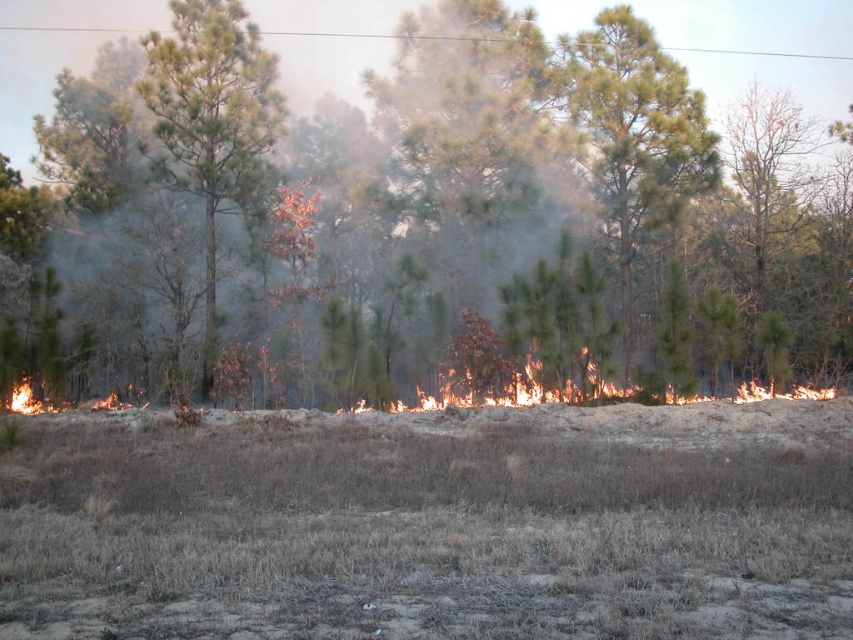
How far apart are green leafy tree at center and green matte tree at center?

5.05 meters

Is green leafy tree at center further to the viewer compared to green matte tree at center?

Yes, green leafy tree at center is further from the viewer.

Is point (103, 36) farther from viewer compared to point (604, 168)?

That is True.

This screenshot has height=640, width=853. Find the location of `green leafy tree at center`. green leafy tree at center is located at coordinates (762, 45).

Describe the element at coordinates (762, 45) in the screenshot. This screenshot has width=853, height=640. I see `green leafy tree at center` at that location.

Which is in front, point (846, 22) or point (154, 92)?

Point (154, 92)

This screenshot has height=640, width=853. I want to click on green leafy tree at center, so click(762, 45).

Which is below, green needle-like tree at center or flaming flames at center?

flaming flames at center is below.

From the picture: Measure the distance from green needle-like tree at center to flaming flames at center.

green needle-like tree at center and flaming flames at center are 28.39 feet apart.

Who is more forward, (206,147) or (637,400)?

Positioned in front is point (637,400).

This screenshot has width=853, height=640. In order to click on green needle-like tree at center in this screenshot , I will do `click(212, 120)`.